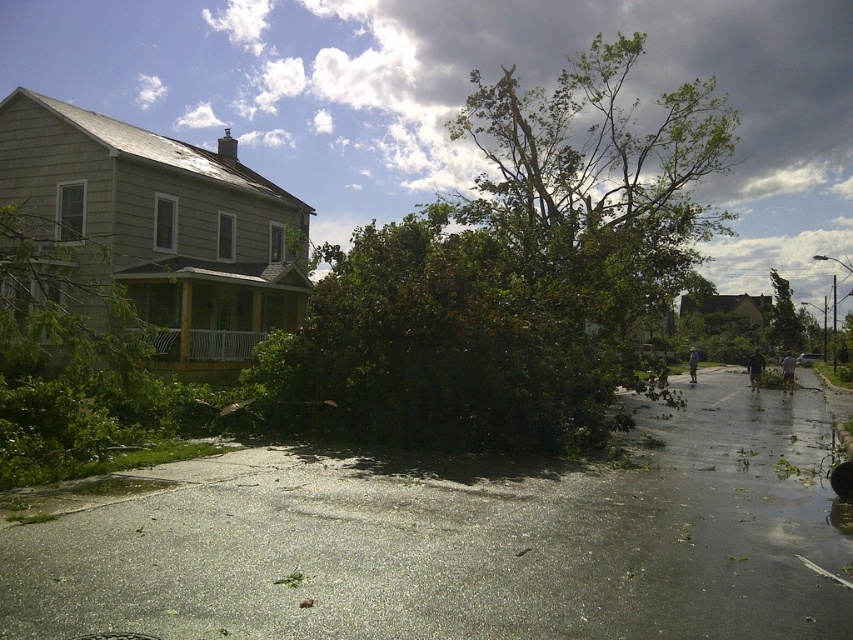
Between green leafy tree at center and green leafy tree at right, which one is positioned lower?

Positioned lower is green leafy tree at right.

Is point (607, 129) more distant than point (798, 326)?

Yes, point (607, 129) is behind point (798, 326).

Is point (399, 282) closer to viewer compared to point (772, 340)?

Yes, it is.

This screenshot has height=640, width=853. I want to click on green leafy tree at center, so click(515, 269).